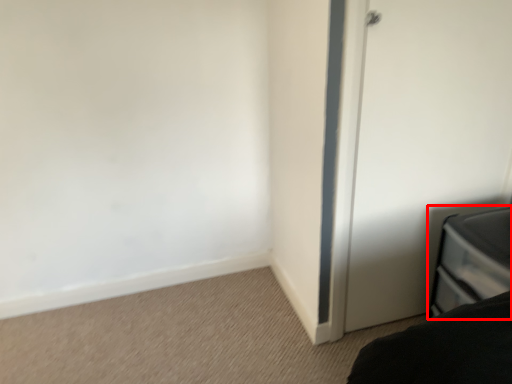
Question: From the image's perspective, where is furniture (annotated by the red box) located relative to door?

Choices:
 (A) above
 (B) below

Answer: (B)